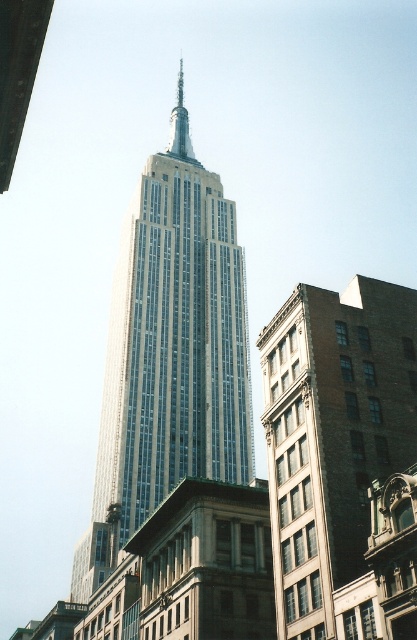
Question: Does glassy steel tower at center appear under brown brick building at lower right?

Choices:
 (A) no
 (B) yes

Answer: (A)

Question: Which point is closer to the camera taking this photo?

Choices:
 (A) (150, 164)
 (B) (269, 474)

Answer: (B)

Question: Which point is farther to the camera?

Choices:
 (A) brown brick building at lower right
 (B) glassy steel tower at center

Answer: (B)

Question: Does glassy steel tower at center have a larger size compared to brown brick building at lower right?

Choices:
 (A) yes
 (B) no

Answer: (A)

Question: Does glassy steel tower at center appear under brown brick building at lower right?

Choices:
 (A) yes
 (B) no

Answer: (B)

Question: Which of the following is the farthest from the observer?

Choices:
 (A) (137, 285)
 (B) (351, 461)

Answer: (A)